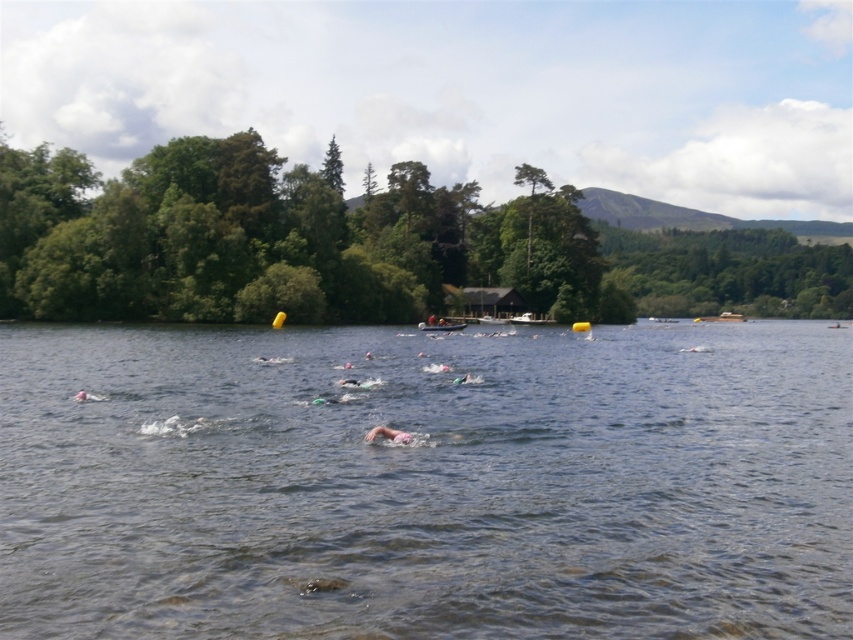
The height and width of the screenshot is (640, 853). What do you see at coordinates (426, 483) in the screenshot?
I see `clear water at center` at bounding box center [426, 483].

Between clear water at center and pink swim cap at center, which one is positioned higher?

clear water at center is higher up.

The height and width of the screenshot is (640, 853). Describe the element at coordinates (426, 483) in the screenshot. I see `clear water at center` at that location.

I want to click on clear water at center, so click(x=426, y=483).

Is pink swim cap at center to the right of white plastic boat at center from the viewer's perspective?

No, pink swim cap at center is not to the right of white plastic boat at center.

Find the location of a particular element. This screenshot has width=853, height=640. pink swim cap at center is located at coordinates (387, 435).

Which is more to the right, clear water at center or white plastic boat at center?

clear water at center is more to the right.

Measure the distance between point [834,605] and camera.

Point [834,605] and camera are 7.36 meters apart from each other.

You are a GUI agent. You are given a task and a screenshot of the screen. Output one action in this format:
    pyautogui.click(x=<x>, y=<y>)
    Task: Click on the clear water at center
    Image resolution: width=853 pixels, height=640 pixels.
    Given the screenshot: What is the action you would take?
    pyautogui.click(x=426, y=483)